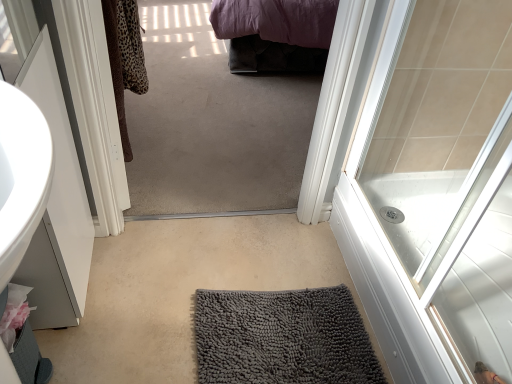
Identify the location of white glossy door at upper right. (435, 192).

This screenshot has height=384, width=512. What do you see at coordinates (183, 292) in the screenshot?
I see `gray textured bath mat at center` at bounding box center [183, 292].

Measure the distance between point [261,364] and camera.

Point [261,364] and camera are 3.95 feet apart from each other.

What are the coordinates of `white glossy door at upper right` in the screenshot? It's located at (435, 192).

Which is behind, gray textured bath mat at center or white glossy door at upper right?

gray textured bath mat at center is more distant.

Is white glossy door at upper right inside gray textured bath mat at center?

No, gray textured bath mat at center does not contain white glossy door at upper right.

Does gray textured bath mat at center have a larger size compared to white glossy door at upper right?

Incorrect, gray textured bath mat at center is not larger than white glossy door at upper right.

Based on their positions, is white glossy door at upper right located to the left or right of gray chenille bath mat at center?

white glossy door at upper right is to the right of gray chenille bath mat at center.

I want to click on bath mat behind the white glossy door at upper right, so [x=282, y=338].

Which is behind, point (452, 18) or point (274, 365)?

The point (274, 365) is behind.

From a real-world perspective, between white glossy door at upper right and gray chenille bath mat at center, who is vertically lower?

gray chenille bath mat at center is physically lower.

Considering the relative sizes of white glossy door at upper right and gray textured bath mat at center in the image provided, is white glossy door at upper right wider than gray textured bath mat at center?

Incorrect, the width of white glossy door at upper right does not surpass that of gray textured bath mat at center.

At what (x,y) coordinates should I click in order to perform the action: click on plain that appears below the white glossy door at upper right (from the image's perspective). Please return your answer as a coordinate pair (x, y). Image resolution: width=512 pixels, height=384 pixels. Looking at the image, I should click on (183, 292).

Considering the points (450, 324) and (313, 232), which point is behind, point (450, 324) or point (313, 232)?

Positioned behind is point (313, 232).

Is the position of white glossy door at upper right more distant than that of gray textured bath mat at center?

That is False.

Is gray textured bath mat at center in front of gray chenille bath mat at center?

That is True.

In the scene shown: From a real-world perspective, is gray textured bath mat at center physically below gray chenille bath mat at center?

Yes, from a real-world perspective, gray textured bath mat at center is beneath gray chenille bath mat at center.

Is point (160, 322) positioned in front of point (215, 380)?

No, it is not.

Can you confirm if gray textured bath mat at center is thinner than gray chenille bath mat at center?

In fact, gray textured bath mat at center might be wider than gray chenille bath mat at center.

Does gray chenille bath mat at center have a lesser height compared to gray textured bath mat at center?

Incorrect, the height of gray chenille bath mat at center does not fall short of that of gray textured bath mat at center.

Considering the sizes of objects gray chenille bath mat at center and gray textured bath mat at center in the image provided, who is wider, gray chenille bath mat at center or gray textured bath mat at center?

gray textured bath mat at center.

Between gray chenille bath mat at center and gray textured bath mat at center, which one has smaller size?

Smaller between the two is gray chenille bath mat at center.

Is gray chenille bath mat at center in contact with gray textured bath mat at center?

No.

Choose the correct answer: Is gray chenille bath mat at center inside white glossy door at upper right or outside it?

gray chenille bath mat at center is not enclosed by white glossy door at upper right.

You are a GUI agent. You are given a task and a screenshot of the screen. Output one action in this format:
    pyautogui.click(x=<x>, y=<y>)
    Task: Click on the door above the gray chenille bath mat at center (from the image's perspective)
    Image resolution: width=512 pixels, height=384 pixels.
    Given the screenshot: What is the action you would take?
    pyautogui.click(x=435, y=192)

Is point (348, 357) farther from camera compared to point (391, 228)?

No, (348, 357) is closer to viewer.

Is gray chenille bath mat at center bigger or smaller than white glossy door at upper right?

In the image, gray chenille bath mat at center appears to be smaller than white glossy door at upper right.

Locate an element on the screen. The image size is (512, 384). door above the gray textured bath mat at center (from a real-world perspective) is located at coordinates (435, 192).

This screenshot has height=384, width=512. Identify the location of door above the gray chenille bath mat at center (from the image's perspective). click(435, 192).

Considering their positions, is gray textured bath mat at center positioned closer to white glossy door at upper right than gray chenille bath mat at center?

Among the two, gray chenille bath mat at center is located nearer to white glossy door at upper right.

From the image, which object appears to be farther from gray textured bath mat at center, gray chenille bath mat at center or white glossy door at upper right?

Among the two, white glossy door at upper right is located further to gray textured bath mat at center.

Estimate the real-world distances between objects in this image. Which object is further from gray chenille bath mat at center, white glossy door at upper right or gray textured bath mat at center?

white glossy door at upper right lies further to gray chenille bath mat at center than the other object.

Estimate the real-world distances between objects in this image. Which object is closer to gray textured bath mat at center, white glossy door at upper right or gray chenille bath mat at center?

gray chenille bath mat at center is positioned closer to the anchor gray textured bath mat at center.

Which object lies nearer to the anchor point gray chenille bath mat at center, gray textured bath mat at center or white glossy door at upper right?

gray textured bath mat at center.

Which object lies further to the anchor point white glossy door at upper right, gray chenille bath mat at center or gray textured bath mat at center?

gray textured bath mat at center is positioned further to the anchor white glossy door at upper right.

This screenshot has width=512, height=384. I want to click on plain between white glossy door at upper right and gray chenille bath mat at center in the front-back direction, so click(x=183, y=292).